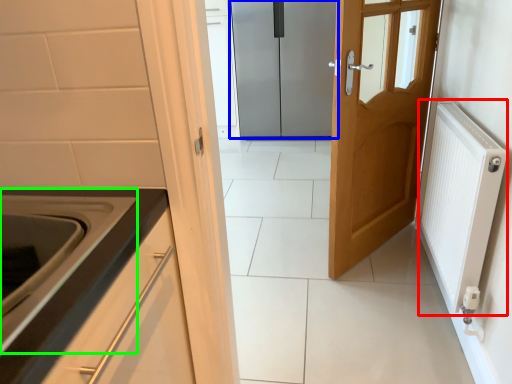
Question: Which object is the farthest from radiator (highlighted by a red box)? Choose among these: door (highlighted by a blue box) or oven (highlighted by a green box).

Choices:
 (A) door
 (B) oven

Answer: (A)